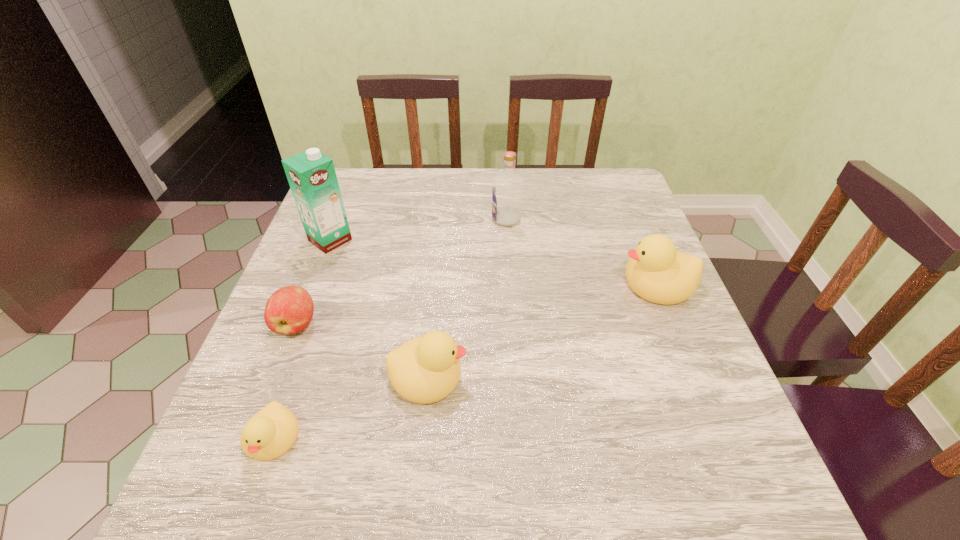
This screenshot has width=960, height=540. Identify the location of vacant region located 0.400m on the face of the second duckling from right to left. (674, 375).

Identify the location of free region located 0.370m on the face of the rightmost duckling. Image resolution: width=960 pixels, height=540 pixels. (462, 282).

Find the location of `vacant region located 0.210m on the face of the rightmost duckling`. vacant region located 0.210m on the face of the rightmost duckling is located at coordinates (530, 282).

You are a GUI agent. You are given a task and a screenshot of the screen. Output one action in this format:
    pyautogui.click(x=<x>, y=<y>)
    Task: Click on the free space located 0.060m on the face of the rightmost duckling
    The height and width of the screenshot is (540, 960).
    Given the screenshot: What is the action you would take?
    pyautogui.click(x=594, y=282)

Locate an element on the screen. vacant space located 0.260m on the label of the vodka is located at coordinates (397, 219).

Find the location of `vacant region located on the label of the vodka`. vacant region located on the label of the vodka is located at coordinates (349, 219).

Identify the location of vacant area situated on the label of the vodka. (379, 219).

Find the location of a particular element. The width and height of the screenshot is (960, 540). vacant space located 0.270m on the back of the carton is located at coordinates (355, 174).

Locate an element on the screen. The width and height of the screenshot is (960, 540). blank space located 0.210m on the back of the fifth tallest object is located at coordinates (326, 246).

This screenshot has height=540, width=960. What are the coordinates of `object present at the far edge` in the screenshot? It's located at (507, 192).